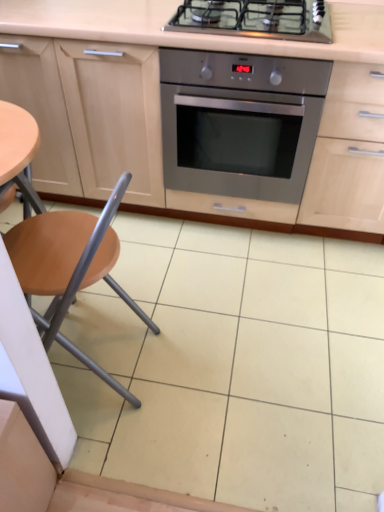
Question: Is wooden seat at left facing towards stainless steel gas stove at upper center?

Choices:
 (A) no
 (B) yes

Answer: (A)

Question: Is wooden seat at left at the right side of stainless steel gas stove at upper center?

Choices:
 (A) no
 (B) yes

Answer: (A)

Question: Is wooden seat at left facing away from stainless steel gas stove at upper center?

Choices:
 (A) no
 (B) yes

Answer: (A)

Question: Considering the relative sizes of wooden seat at left and stainless steel gas stove at upper center in the image provided, is wooden seat at left smaller than stainless steel gas stove at upper center?

Choices:
 (A) yes
 (B) no

Answer: (B)

Question: From the image's perspective, is wooden seat at left beneath stainless steel gas stove at upper center?

Choices:
 (A) no
 (B) yes

Answer: (B)

Question: Does wooden seat at left come behind stainless steel gas stove at upper center?

Choices:
 (A) yes
 (B) no

Answer: (B)

Question: Is wooden seat at left taller than stainless steel oven at center?

Choices:
 (A) yes
 (B) no

Answer: (A)

Question: Is wooden seat at left not inside stainless steel oven at center?

Choices:
 (A) no
 (B) yes

Answer: (B)

Question: Could you tell me if wooden seat at left is turned towards stainless steel oven at center?

Choices:
 (A) no
 (B) yes

Answer: (A)

Question: From the image's perspective, does wooden seat at left appear lower than stainless steel oven at center?

Choices:
 (A) yes
 (B) no

Answer: (A)

Question: Is wooden seat at left in front of stainless steel oven at center?

Choices:
 (A) yes
 (B) no

Answer: (A)

Question: Is stainless steel oven at center a part of wooden seat at left?

Choices:
 (A) no
 (B) yes

Answer: (A)

Question: Is wooden seat at left completely or partially inside stainless steel oven at center?

Choices:
 (A) no
 (B) yes

Answer: (A)